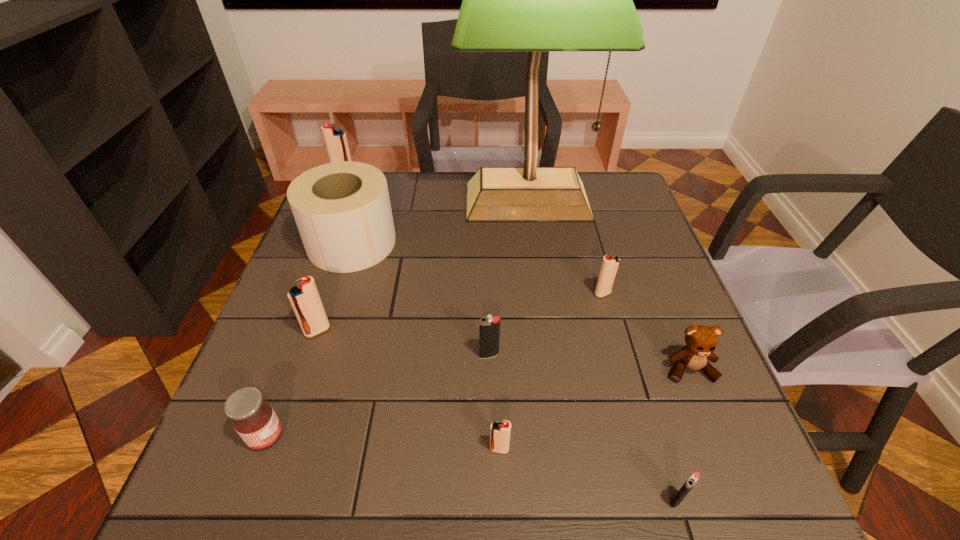
In the image, there is a desktop. At what (x,y) coordinates should I click in order to perform the action: click on vacant space at the far right corner. Please return your answer as a coordinate pair (x, y). The width and height of the screenshot is (960, 540). Looking at the image, I should click on [594, 175].

You are a GUI agent. You are given a task and a screenshot of the screen. Output one action in this format:
    pyautogui.click(x=<x>, y=<y>)
    Task: Click on the vacant point at the near right corner
    The image size is (960, 540).
    Given the screenshot: What is the action you would take?
    pyautogui.click(x=726, y=514)

In order to click on free spot between the seventh nearest object and the nearer black igniter in this screenshot , I will do `click(639, 397)`.

Where is `vacant point located between the smallest red igniter and the fifth shortest igniter`? The height and width of the screenshot is (540, 960). vacant point located between the smallest red igniter and the fifth shortest igniter is located at coordinates (408, 390).

The image size is (960, 540). In order to click on free space between the toilet tissue and the seventh nearest object in this screenshot , I will do `click(477, 268)`.

At what (x,y) coordinates should I click in order to perform the action: click on free space between the brown teddy bear and the farther black igniter. Please return your answer as a coordinate pair (x, y). The width and height of the screenshot is (960, 540). Looking at the image, I should click on coord(589,362).

Where is `free space that is in between the sixth nearest object and the second farthest igniter`? free space that is in between the sixth nearest object and the second farthest igniter is located at coordinates (460, 312).

Identify the location of vacant space that's between the jam and the toilet tissue. The image size is (960, 540). (309, 340).

You are a GUI agent. You are given a task and a screenshot of the screen. Output one action in this format:
    pyautogui.click(x=<x>, y=<y>)
    Task: Click on the vacant area that lies between the fourth farthest igniter and the jam
    
    Given the screenshot: What is the action you would take?
    pyautogui.click(x=378, y=396)

Image resolution: width=960 pixels, height=540 pixels. Identify the location of free space between the left black igniter and the leftmost red igniter. (x=417, y=266).